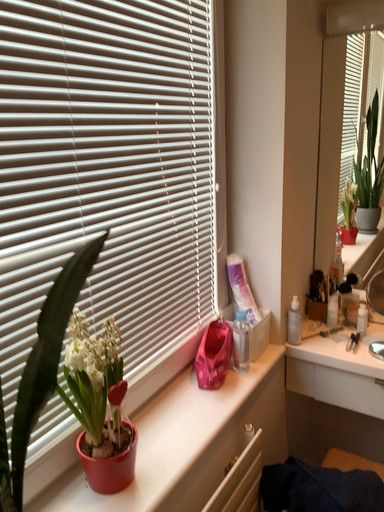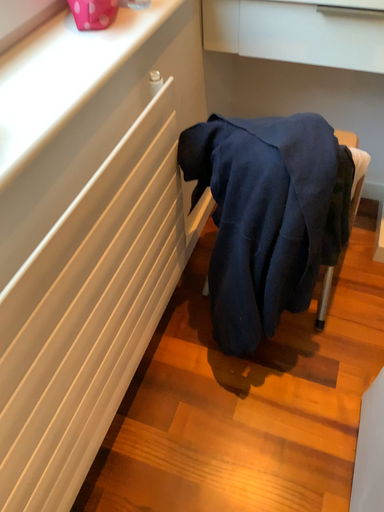
Question: How did the camera likely rotate when shooting the video?

Choices:
 (A) rotated right
 (B) rotated left

Answer: (A)